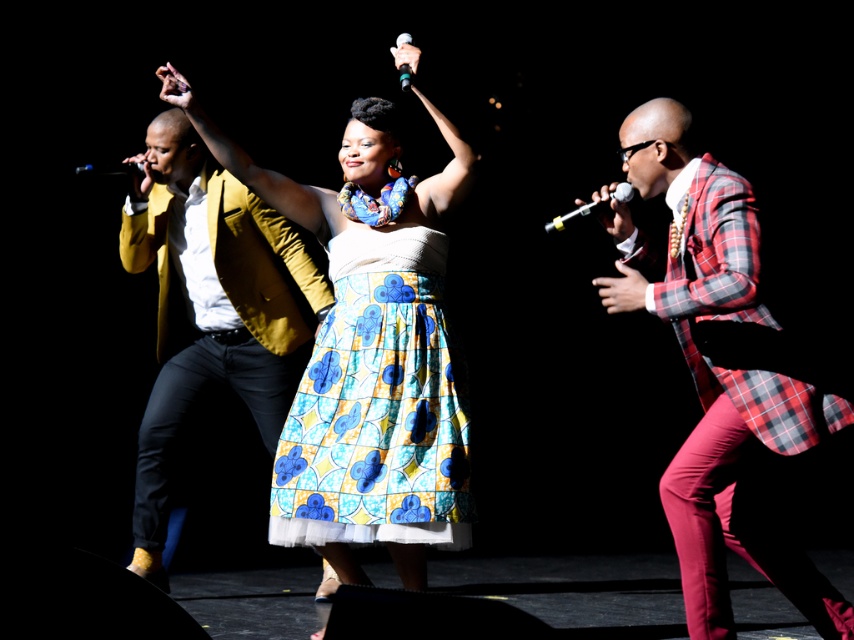
Consider the image. You are an audience member sitting in the front row. You notice the plaid fabric suit at right and the blue and yellow printed fabric skirt at center. Which one is higher in position?

The plaid fabric suit at right is located above the blue and yellow printed fabric skirt at center, so it is higher in position.

You are a stagehand who needs to place a 5.5 feet long banner between the shiny black microphone at upper left and the metallic silver microphone at upper center. Will the banner fit without overlapping either microphone?

The distance between the shiny black microphone at upper left and metallic silver microphone at upper center is 5.37 feet. Since the banner is 5.5 feet long, it will not fit as it is longer than the available space between them.